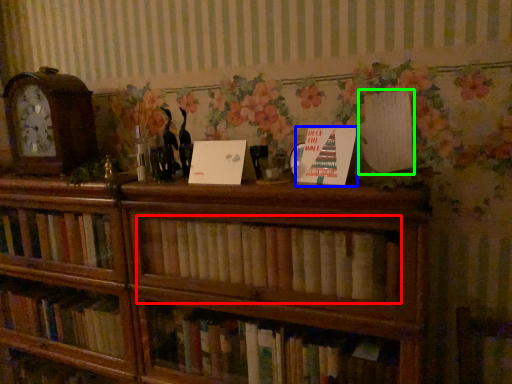
Question: Which is nearer to the book (highlighted by a red box)? paperback book (highlighted by a blue box) or paperback book (highlighted by a green box).

Choices:
 (A) paperback book
 (B) paperback book

Answer: (A)